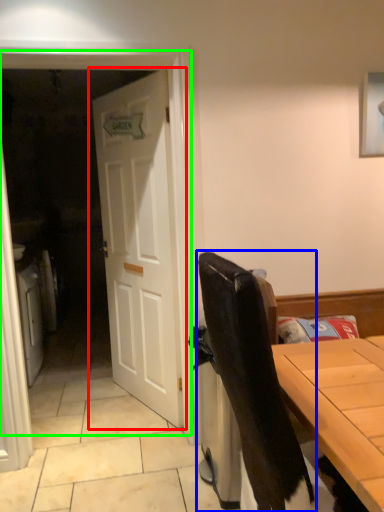
Question: Estimate the real-world distances between objects in this image. Which object is closer to door (highlighted by a red box), chair (highlighted by a blue box) or screen door (highlighted by a green box)?

Choices:
 (A) chair
 (B) screen door

Answer: (B)